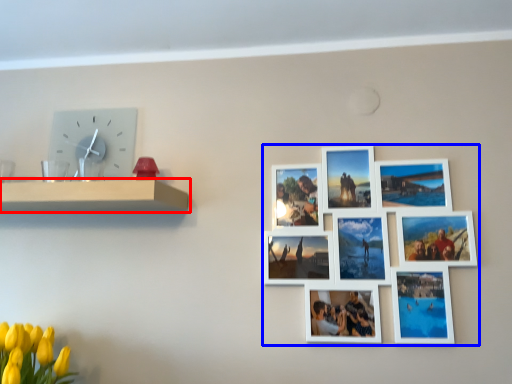
Question: Among these objects, which one is farthest to the camera, shelf (highlighted by a red box) or picture frame (highlighted by a blue box)?

Choices:
 (A) shelf
 (B) picture frame

Answer: (B)